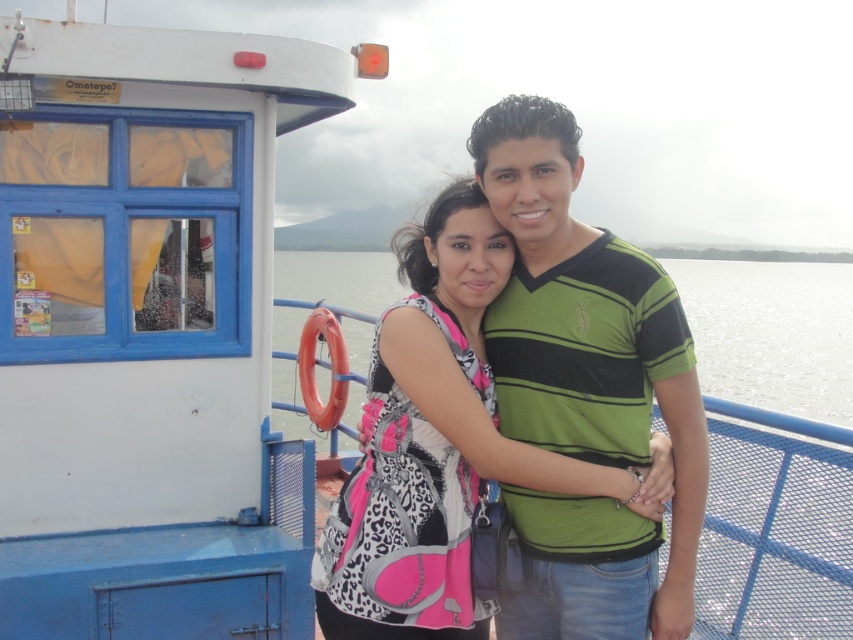
You are a photographer trying to capture a photo of the green striped shirt at center and the pink leopard print backpack at center from above. Which object would appear smaller in the photo?

The pink leopard print backpack at center would appear smaller in the photo because it has a lesser height compared to the green striped shirt at center.

You are a photographer trying to capture a closeup shot of both the green striped shirt at center and the pink leopard print backpack at center. Given that your camera has a maximum focus range of 7 inches, will you be able to capture both subjects in focus without moving the camera?

The distance between the green striped shirt at center and the pink leopard print backpack at center is 7.79 inches, which exceeds the camera maximum focus range of 7 inches. Therefore, you cannot capture both subjects in focus without moving the camera.